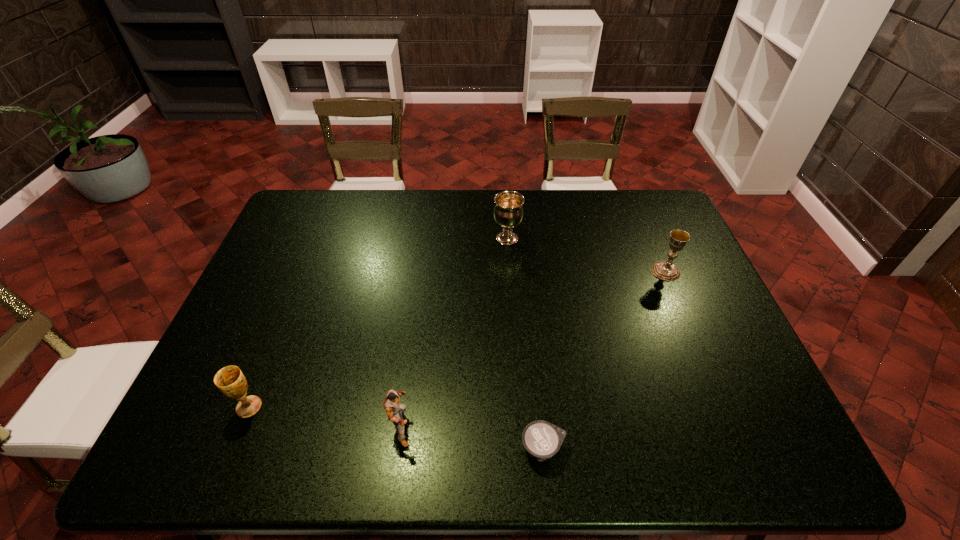
Find the location of a particular element. Image resolution: width=960 pixels, height=540 pixels. free location at the left edge of the desktop is located at coordinates (260, 289).

Locate an element on the screen. The image size is (960, 540). vacant space at the right edge of the desktop is located at coordinates (767, 411).

The height and width of the screenshot is (540, 960). What are the coordinates of `free space at the far left corner` in the screenshot? It's located at (335, 198).

This screenshot has height=540, width=960. Find the location of `free space at the near left corner of the desktop`. free space at the near left corner of the desktop is located at coordinates (169, 443).

At what (x,y) coordinates should I click in order to perform the action: click on free region at the near right corner. Please return your answer as a coordinate pair (x, y). This screenshot has height=540, width=960. Looking at the image, I should click on (786, 442).

Identify the location of free space between the second chalice from left to right and the puncher. (454, 333).

The width and height of the screenshot is (960, 540). In order to click on vacant area that lies between the yogurt and the puncher in this screenshot , I will do `click(472, 437)`.

You are a GUI agent. You are given a task and a screenshot of the screen. Output one action in this format:
    pyautogui.click(x=<x>, y=<y>)
    Task: Click on the free space between the puncher and the nearest chalice
    The height and width of the screenshot is (540, 960).
    Given the screenshot: What is the action you would take?
    coord(325,417)

The height and width of the screenshot is (540, 960). I want to click on unoccupied area between the leftmost chalice and the puncher, so click(325, 417).

At what (x,y) coordinates should I click in order to perform the action: click on unoccupied area between the leftmost chalice and the farthest chalice. Please return your answer as a coordinate pair (x, y). The width and height of the screenshot is (960, 540). Looking at the image, I should click on [x=378, y=323].